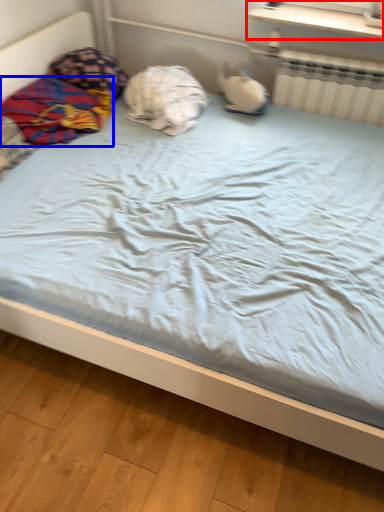
Question: Which object appears closest to the camera in this image, window sill (highlighted by a red box) or material (highlighted by a blue box)?

Choices:
 (A) window sill
 (B) material

Answer: (B)